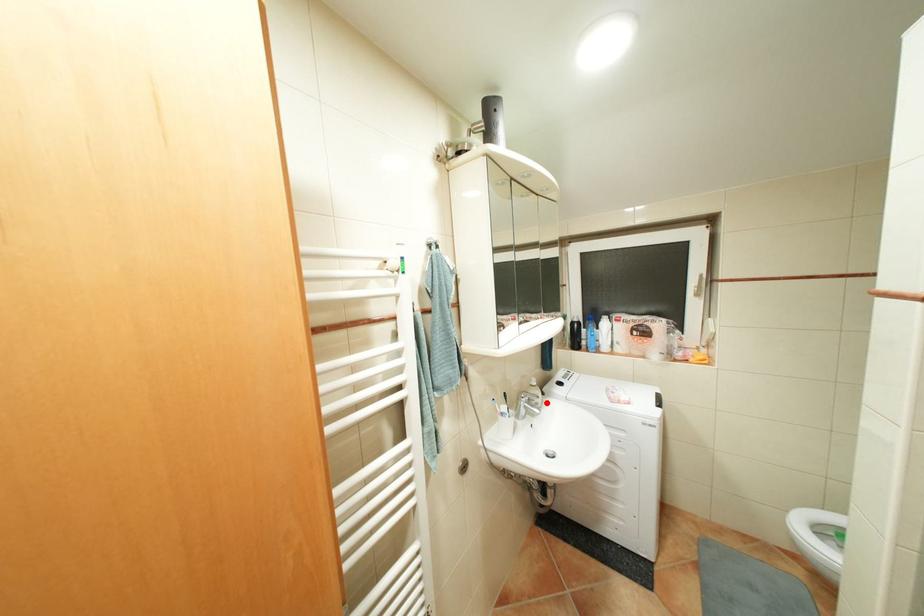
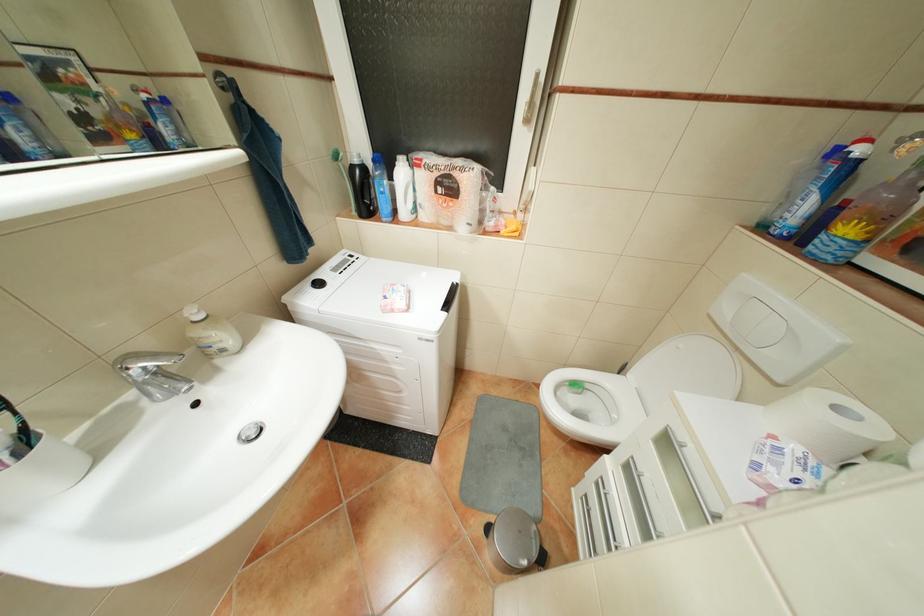
Find the pixel in the second image that matches the highlighted location in the first image.

(233, 350)